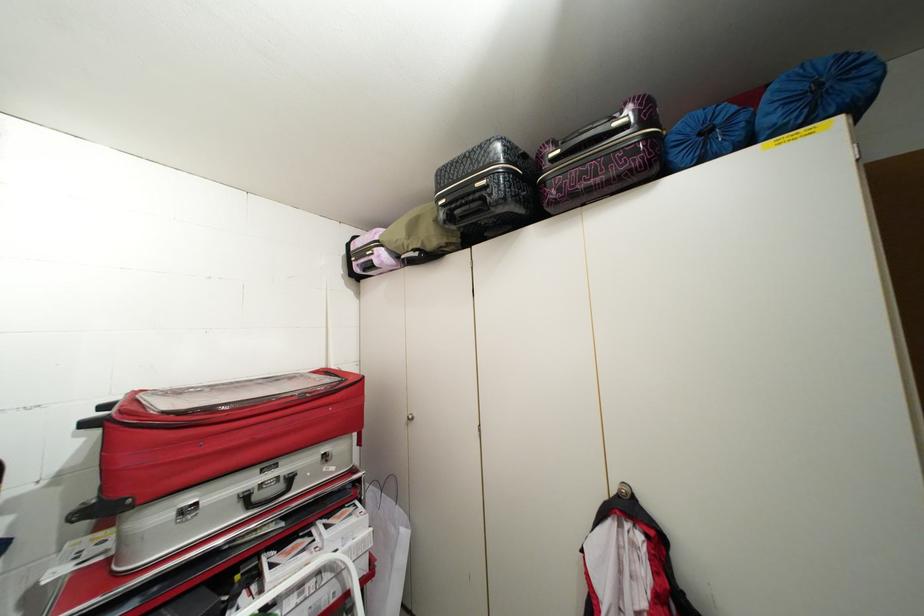
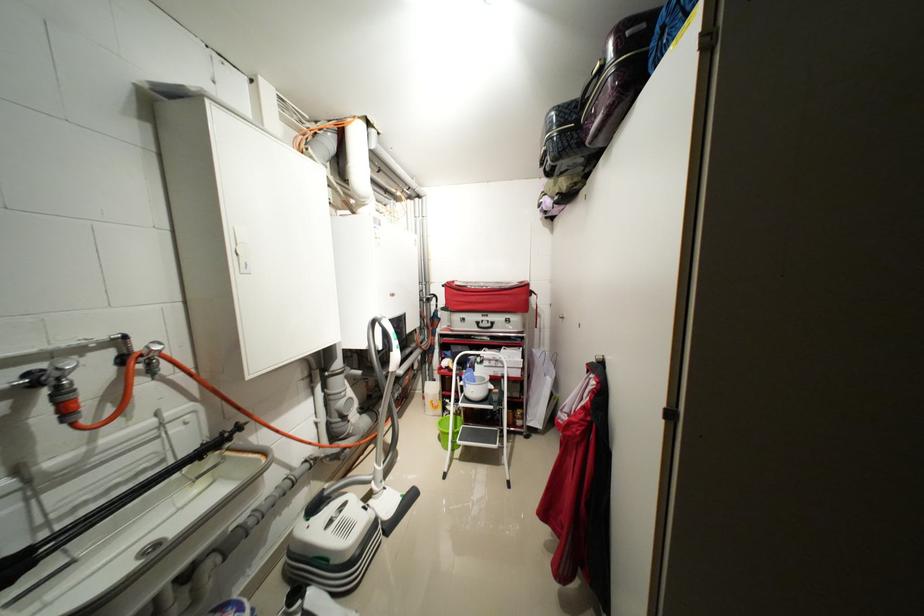
Find the pixel in the second image that matches point (287, 487) in the first image.

(496, 326)